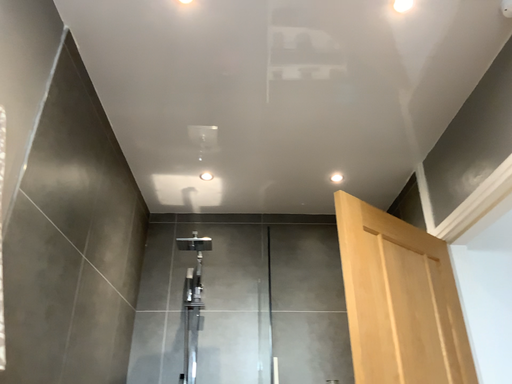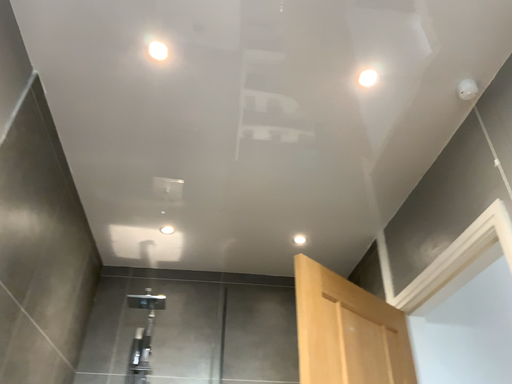
Question: How did the camera likely rotate when shooting the video?

Choices:
 (A) rotated upward
 (B) rotated downward

Answer: (A)